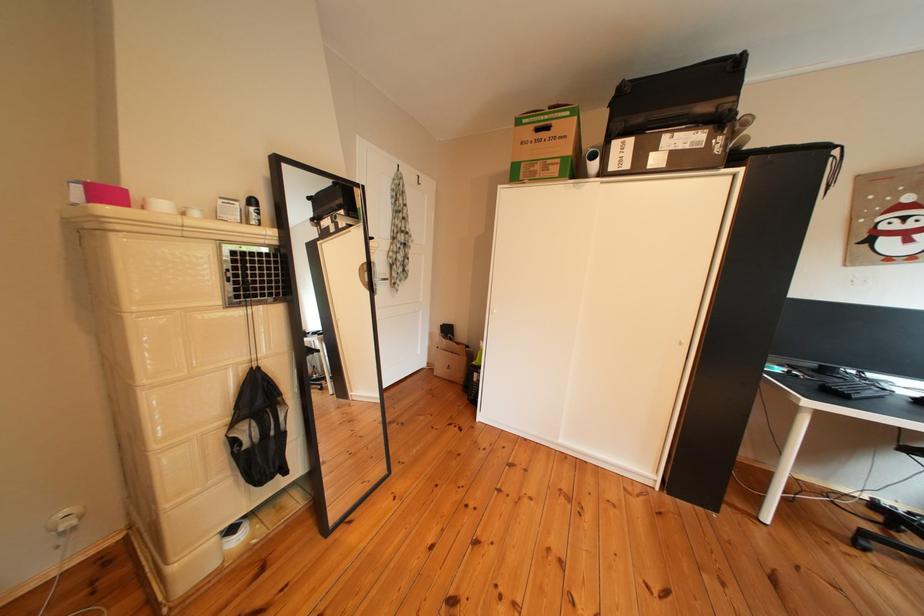
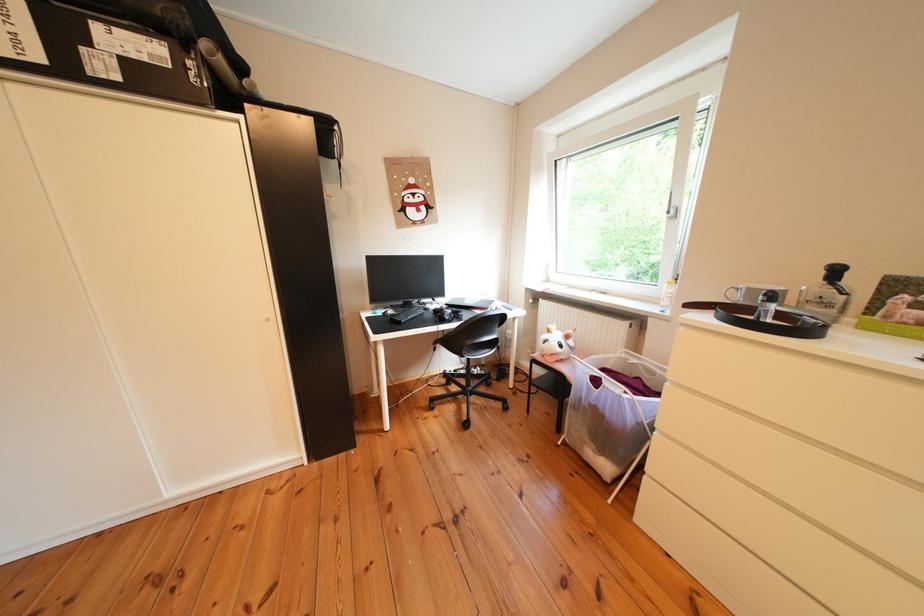
The point at [676,169] is marked in the first image. Where is the corresponding point in the second image?

(131, 83)